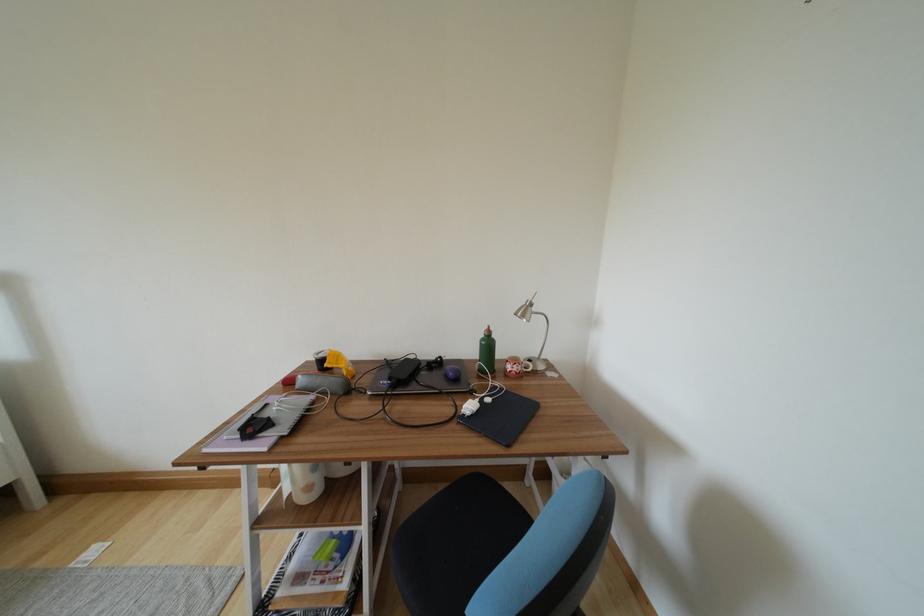
Find where to sit the chair sitting surface. Please return your answer as a coordinate pair (x, y).

(455, 544)